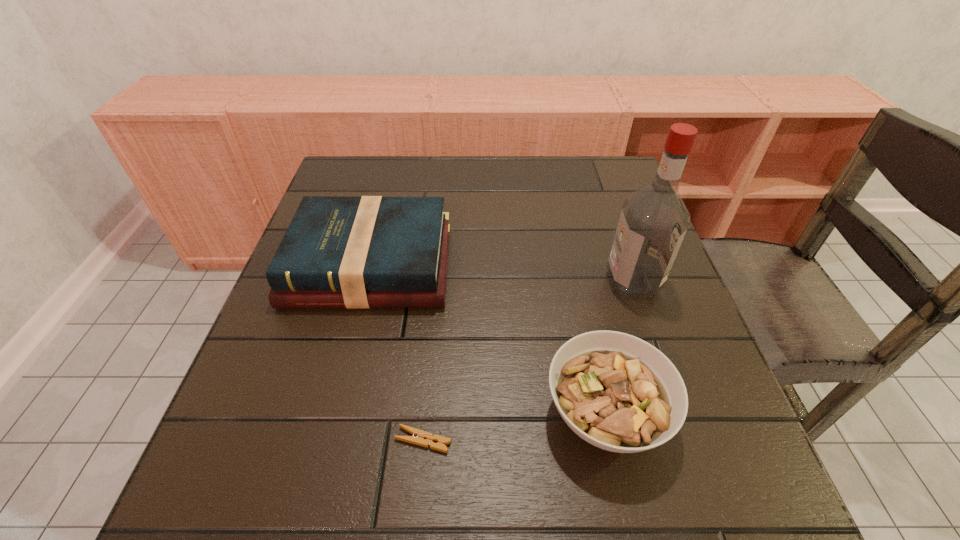
Image resolution: width=960 pixels, height=540 pixels. Identify the location of object that is the second nearest to the hardback book. (425, 439).

Identify the location of blank space that satisfies the following two spatial constraints: 1. on the front side of the clothespin; 2. on the left side of the hardback book. (325, 440).